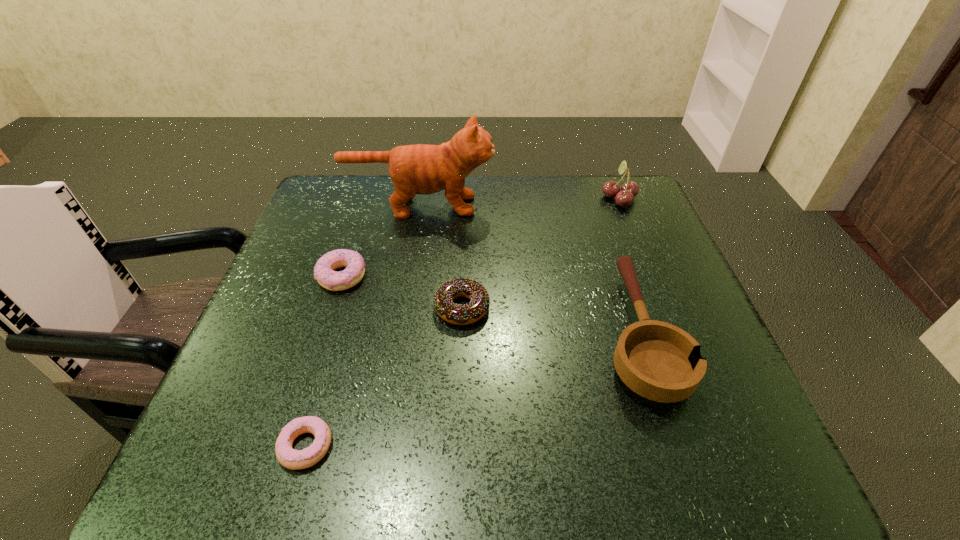
Point out which doughnut is positioned as the third nearest to the cat. Please provide its 2D coordinates. Your answer should be formatted as a tuple, i.e. [(x, y)], where the tuple contains the x and y coordinates of a point satisfying the conditions above.

[(288, 457)]

Identify which doughnut is located as the nearest to the rightmost doughnut. Please provide its 2D coordinates. Your answer should be formatted as a tuple, i.e. [(x, y)], where the tuple contains the x and y coordinates of a point satisfying the conditions above.

[(324, 273)]

The height and width of the screenshot is (540, 960). In order to click on vacant region that satisfies the following two spatial constraints: 1. on the leaves of the cherry; 2. on the front side of the rightmost doughnut in this screenshot , I will do `click(663, 308)`.